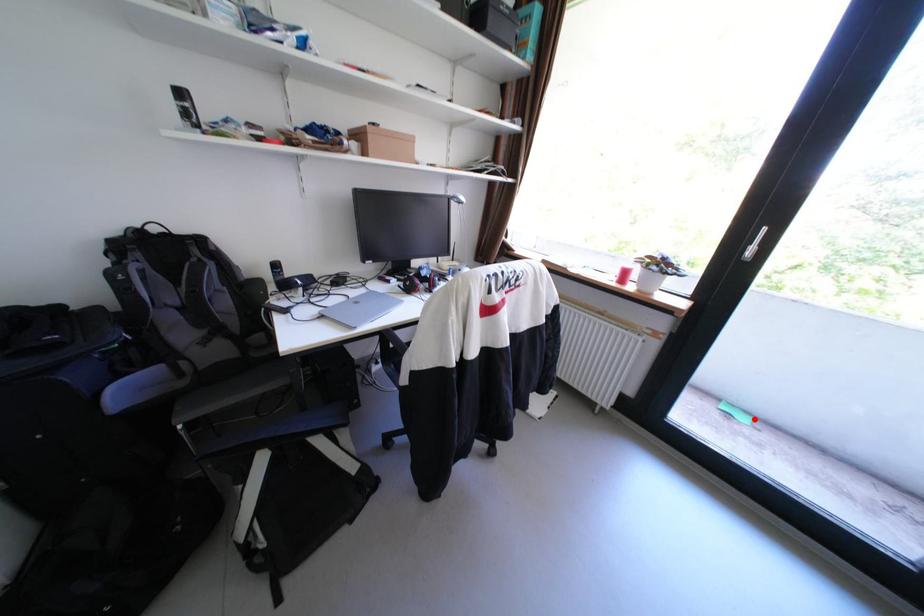
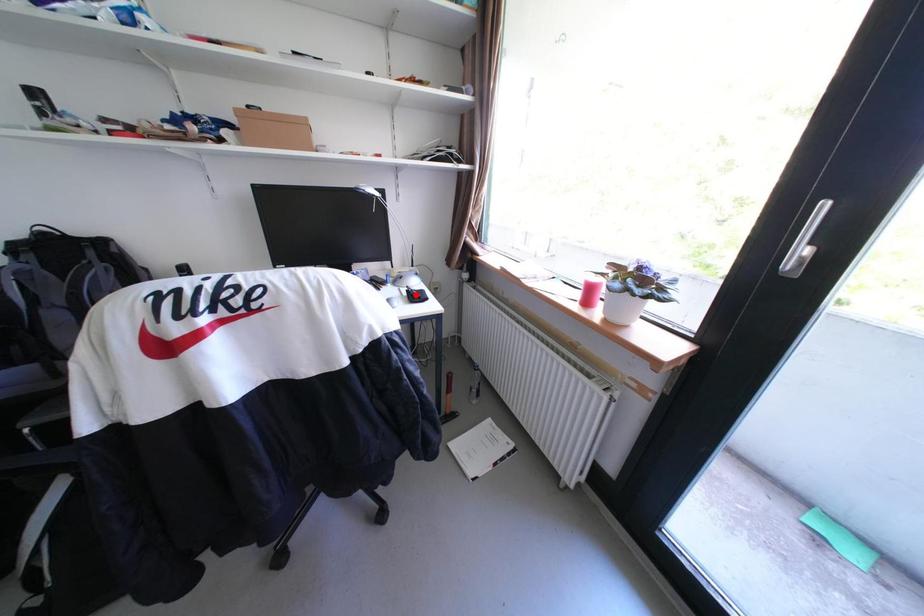
I am providing you with two images of the same scene from different viewpoints. A red point is marked on the first image and another point is marked on the second image. Does the point marked in image1 correspond to the same location as the one in image2?

No